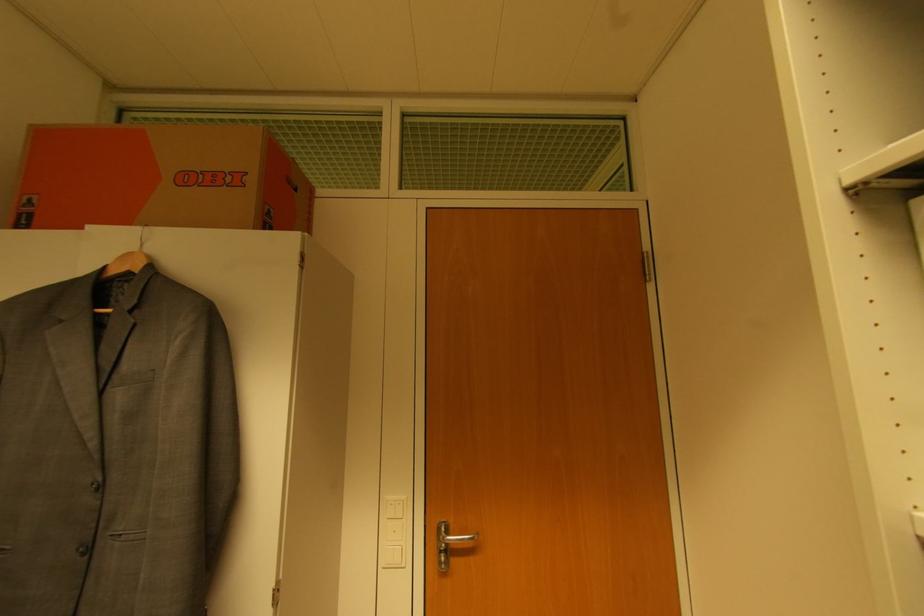
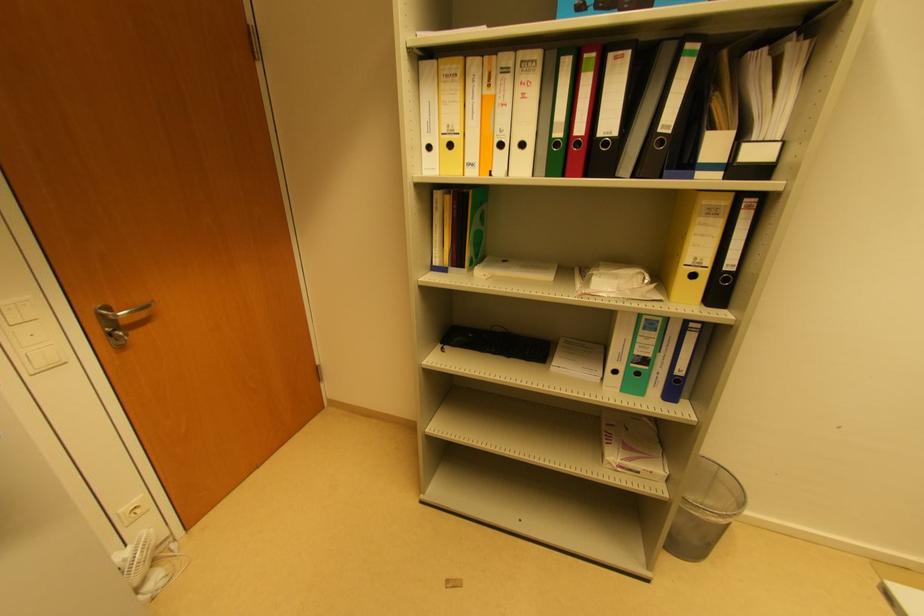
Where in the second image is the point corresponding to point (444, 532) from the first image?

(106, 314)